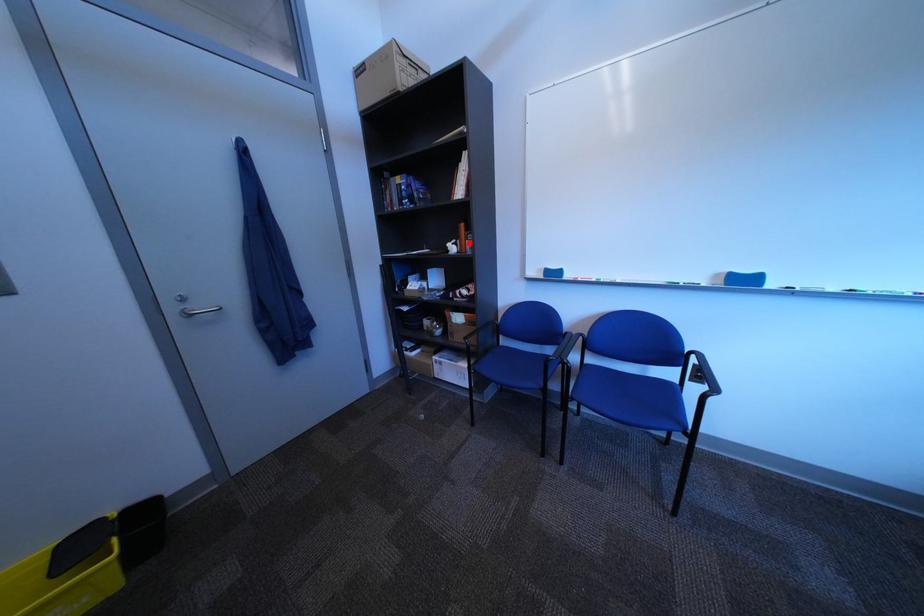
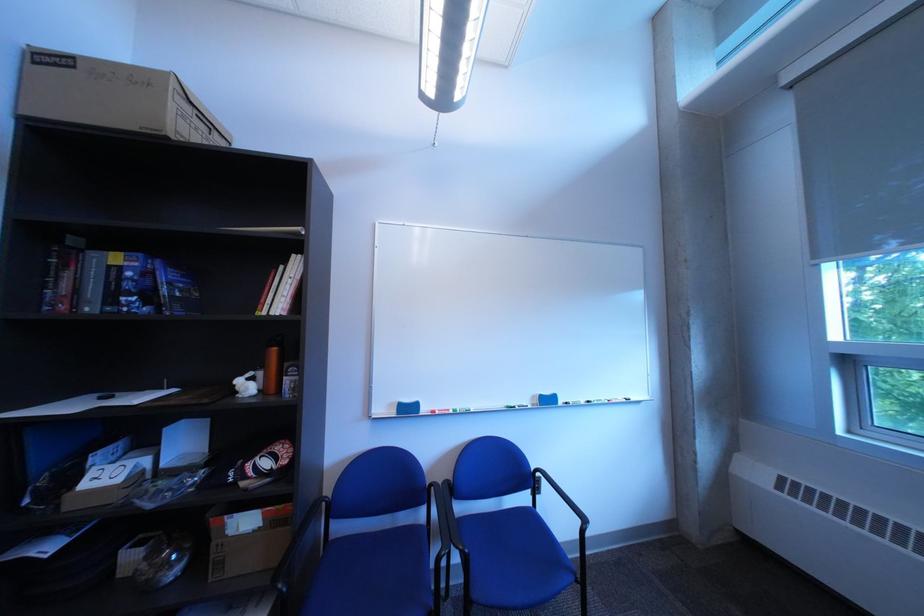
Question: A red point is marked in image1. In image2, is the corresponding 3D point closer to the camera or farther? Reply with the corresponding letter.

Choices:
 (A) The corresponding 3D point is closer.
 (B) The corresponding 3D point is farther.

Answer: (B)